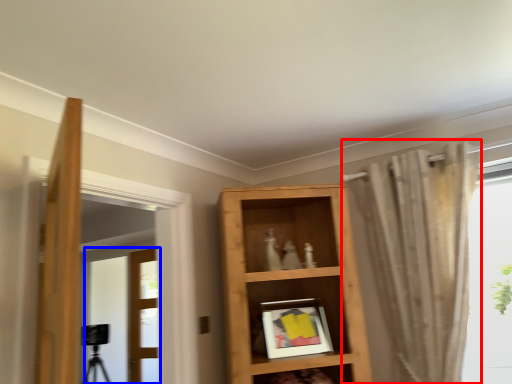
Question: Which object is further to the camera taking this photo, curtain (highlighted by a red box) or door (highlighted by a blue box)?

Choices:
 (A) curtain
 (B) door

Answer: (B)